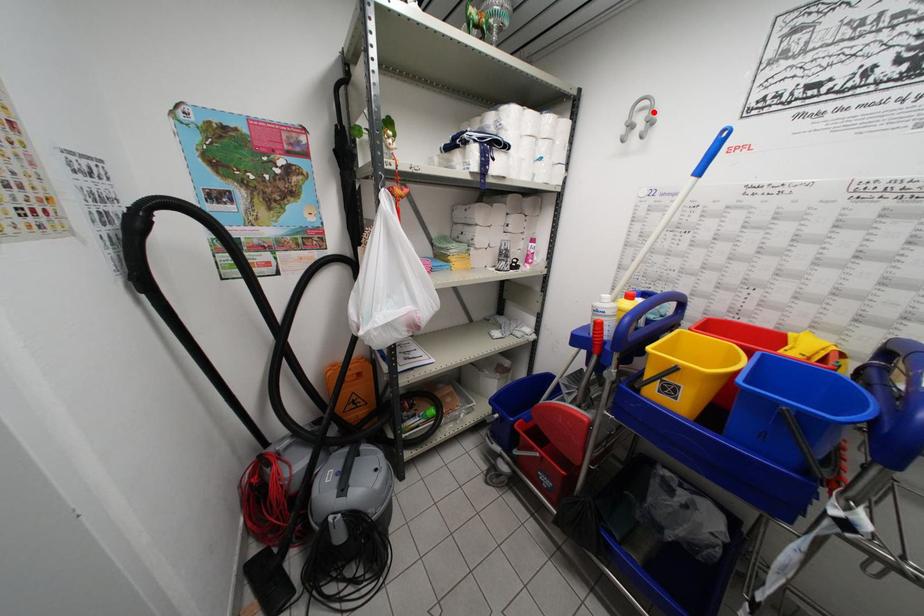
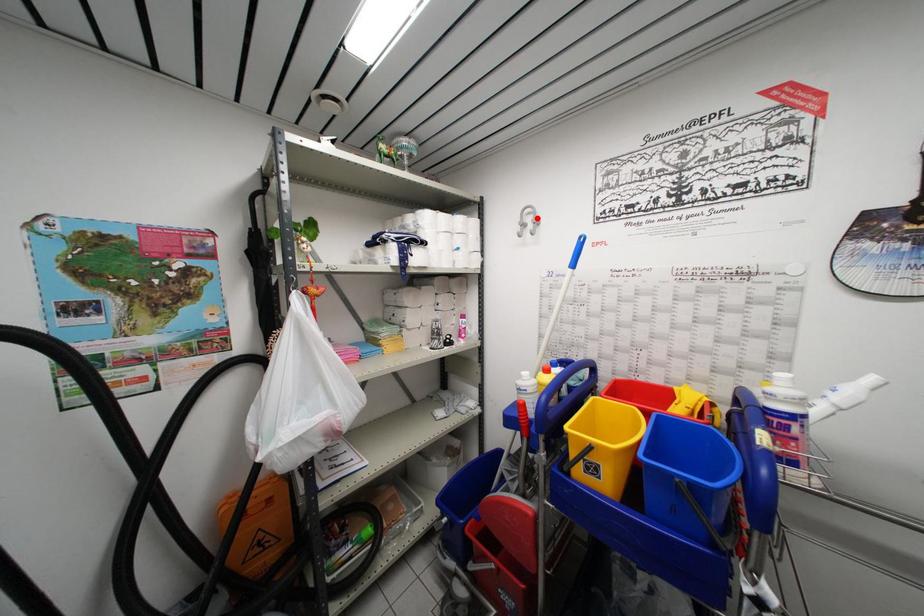
I am providing you with two images of the same scene from different viewpoints. A red point is marked on the first image and another point is marked on the second image. Does the point marked in image1 correspond to the same location as the one in image2?

Yes